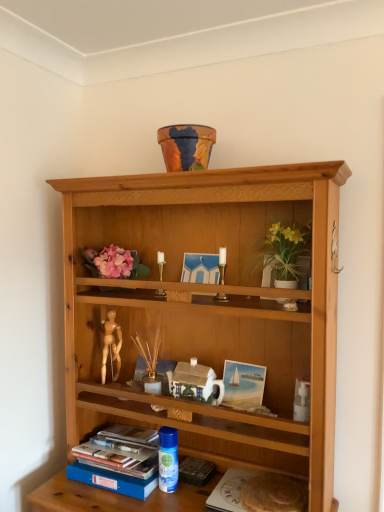
I want to click on empty space that is ontop of blue hardcover book at lower left (from a real-world perspective), so click(127, 440).